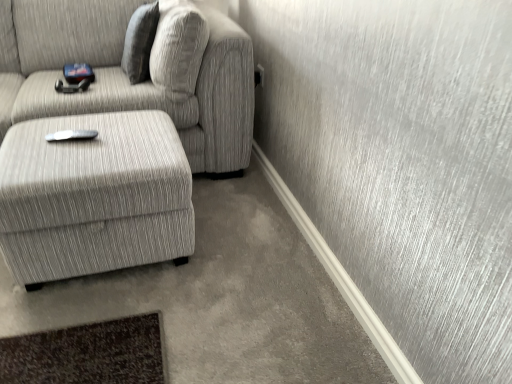
Question: Is textured gray fabric couch at left looking in the opposite direction of textured gray ottoman at lower left?

Choices:
 (A) yes
 (B) no

Answer: (B)

Question: Is textured gray fabric couch at left completely or partially outside of textured gray ottoman at lower left?

Choices:
 (A) no
 (B) yes

Answer: (B)

Question: Is textured gray fabric couch at left facing towards textured gray ottoman at lower left?

Choices:
 (A) no
 (B) yes

Answer: (B)

Question: Does textured gray fabric couch at left have a greater width compared to textured gray ottoman at lower left?

Choices:
 (A) no
 (B) yes

Answer: (B)

Question: From a real-world perspective, is textured gray fabric couch at left located beneath textured gray ottoman at lower left?

Choices:
 (A) no
 (B) yes

Answer: (A)

Question: Can you confirm if textured gray fabric couch at left is taller than textured gray ottoman at lower left?

Choices:
 (A) yes
 (B) no

Answer: (A)

Question: Could you tell me if textured gray pillow at upper center is facing textured gray ottoman at lower left?

Choices:
 (A) no
 (B) yes

Answer: (A)

Question: Does textured gray pillow at upper center appear on the left side of textured gray ottoman at lower left?

Choices:
 (A) yes
 (B) no

Answer: (B)

Question: From the image's perspective, is textured gray pillow at upper center above textured gray ottoman at lower left?

Choices:
 (A) no
 (B) yes

Answer: (B)

Question: Is textured gray pillow at upper center with textured gray ottoman at lower left?

Choices:
 (A) no
 (B) yes

Answer: (A)

Question: Is textured gray pillow at upper center looking in the opposite direction of textured gray ottoman at lower left?

Choices:
 (A) no
 (B) yes

Answer: (A)

Question: From the image's perspective, is textured gray pillow at upper center under textured gray ottoman at lower left?

Choices:
 (A) no
 (B) yes

Answer: (A)

Question: Can you confirm if textured gray fabric couch at left is shorter than textured gray pillow at upper center?

Choices:
 (A) no
 (B) yes

Answer: (A)